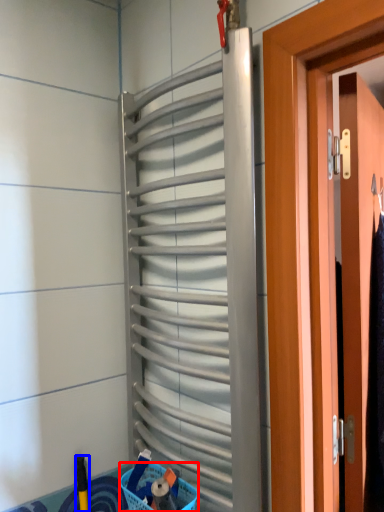
Question: Which object is closer to the camera taking this photo, basket (highlighted by a red box) or brush (highlighted by a blue box)?

Choices:
 (A) basket
 (B) brush

Answer: (A)